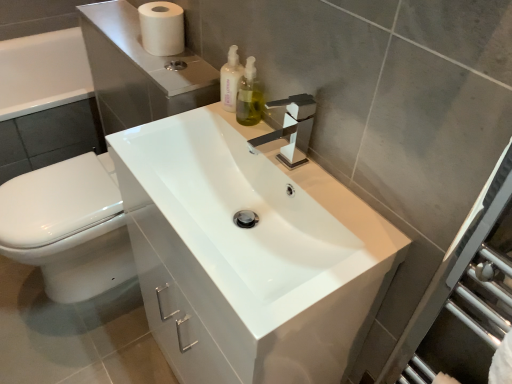
Find the location of a particular element. Image resolution: width=512 pixels, height=384 pixels. green glass soap dispenser at upper center, arranged as the 2th soap dispenser when viewed from the left is located at coordinates (249, 97).

In the scene shown: Measure the distance between point (249, 100) and camera.

A distance of 1.05 meters exists between point (249, 100) and camera.

This screenshot has width=512, height=384. Describe the element at coordinates (67, 227) in the screenshot. I see `white glossy toilet at lower left` at that location.

Identify the location of white glossy sink at center. This screenshot has width=512, height=384. (252, 210).

Identify the location of green glass soap dispenser at upper center, the first soap dispenser from the right. This screenshot has height=384, width=512. (249, 97).

From the picture: Is white glossy sink at center not close to white matte toilet paper at upper left?

No.

Considering the sizes of objects white glossy sink at center and white matte toilet paper at upper left in the image provided, who is bigger, white glossy sink at center or white matte toilet paper at upper left?

white glossy sink at center.

From the image's perspective, is white glossy sink at center positioned above or below white matte toilet paper at upper left?

white glossy sink at center is situated lower than white matte toilet paper at upper left in the image.

Is white glossy toilet at lower left to the left or to the right of translucent plastic soap dispenser at upper center, which appears as the 2th soap dispenser when viewed from the right, in the image?

In the image, white glossy toilet at lower left appears on the left side of translucent plastic soap dispenser at upper center, which appears as the 2th soap dispenser when viewed from the right.

Is white glossy toilet at lower left positioned before translucent plastic soap dispenser at upper center, which appears as the 2th soap dispenser when viewed from the right?

No, the depth of white glossy toilet at lower left is greater than that of translucent plastic soap dispenser at upper center, which appears as the 2th soap dispenser when viewed from the right.

From a real-world perspective, is white glossy toilet at lower left located beneath translucent plastic soap dispenser at upper center, which appears as the 2th soap dispenser when viewed from the right?

Yes, from a real-world perspective, white glossy toilet at lower left is below translucent plastic soap dispenser at upper center, which appears as the 2th soap dispenser when viewed from the right.

From the image's perspective, would you say white glossy toilet at lower left is positioned over translucent plastic soap dispenser at upper center, which appears as the 2th soap dispenser when viewed from the right?

No.

Is the position of green glass soap dispenser at upper center, the first soap dispenser from the right, less distant than that of white matte toilet paper at upper left?

Yes, the depth of green glass soap dispenser at upper center, the first soap dispenser from the right, is less than that of white matte toilet paper at upper left.

Does green glass soap dispenser at upper center, arranged as the 2th soap dispenser when viewed from the left, have a smaller size compared to white matte toilet paper at upper left?

Yes, green glass soap dispenser at upper center, arranged as the 2th soap dispenser when viewed from the left, is smaller than white matte toilet paper at upper left.

Is green glass soap dispenser at upper center, arranged as the 2th soap dispenser when viewed from the left, facing towards white matte toilet paper at upper left?

No, green glass soap dispenser at upper center, arranged as the 2th soap dispenser when viewed from the left, is not facing towards white matte toilet paper at upper left.

Is green glass soap dispenser at upper center, the first soap dispenser from the right, surrounding white matte toilet paper at upper left?

Actually, white matte toilet paper at upper left is outside green glass soap dispenser at upper center, the first soap dispenser from the right.

Find the location of a particular element. This screenshot has width=512, height=384. the 2nd soap dispenser behind the white glossy sink at center, counting from the anchor's position is located at coordinates (230, 80).

Is translucent plastic soap dispenser at upper center, which appears as the 2th soap dispenser when viewed from the right, positioned beyond the bounds of white glossy sink at center?

Yes, translucent plastic soap dispenser at upper center, which appears as the 2th soap dispenser when viewed from the right, is not within white glossy sink at center.

Does translucent plastic soap dispenser at upper center, the 1th soap dispenser in the left-to-right sequence, lie in front of white glossy sink at center?

No, translucent plastic soap dispenser at upper center, the 1th soap dispenser in the left-to-right sequence, is further to the viewer.

Is point (224, 87) less distant than point (313, 246)?

That is False.

Are white matte toilet paper at upper left and white glossy sink at center making contact?

No, white matte toilet paper at upper left is not beside white glossy sink at center.

Does white matte toilet paper at upper left have a lesser height compared to white glossy sink at center?

Correct, white matte toilet paper at upper left is not as tall as white glossy sink at center.

Is white glossy sink at center at the back of white matte toilet paper at upper left?

No, white matte toilet paper at upper left's orientation is not away from white glossy sink at center.

From a real-world perspective, is white matte toilet paper at upper left located higher than white glossy sink at center?

Yes, from a real-world perspective, white matte toilet paper at upper left is above white glossy sink at center.

Does white glossy sink at center have a larger size compared to translucent plastic soap dispenser at upper center, the 1th soap dispenser in the left-to-right sequence?

Yes.

Between white glossy sink at center and translucent plastic soap dispenser at upper center, the 1th soap dispenser in the left-to-right sequence, which one is positioned in front?

Positioned in front is white glossy sink at center.

Is white glossy sink at center taller than translucent plastic soap dispenser at upper center, which appears as the 2th soap dispenser when viewed from the right?

Indeed, white glossy sink at center has a greater height compared to translucent plastic soap dispenser at upper center, which appears as the 2th soap dispenser when viewed from the right.

In the scene shown: Does white glossy sink at center appear on the right side of translucent plastic soap dispenser at upper center, which appears as the 2th soap dispenser when viewed from the right?

Indeed, white glossy sink at center is positioned on the right side of translucent plastic soap dispenser at upper center, which appears as the 2th soap dispenser when viewed from the right.

Looking at this image, is green glass soap dispenser at upper center, arranged as the 2th soap dispenser when viewed from the left, touching white glossy toilet at lower left?

They are not placed beside each other.

Based on their sizes in the image, would you say green glass soap dispenser at upper center, arranged as the 2th soap dispenser when viewed from the left, is bigger or smaller than white glossy toilet at lower left?

Considering their sizes, green glass soap dispenser at upper center, arranged as the 2th soap dispenser when viewed from the left, takes up less space than white glossy toilet at lower left.

Measure the distance between green glass soap dispenser at upper center, the first soap dispenser from the right, and white glossy toilet at lower left.

The distance of green glass soap dispenser at upper center, the first soap dispenser from the right, from white glossy toilet at lower left is 29.89 inches.

Is green glass soap dispenser at upper center, the first soap dispenser from the right, taller or shorter than white glossy toilet at lower left?

green glass soap dispenser at upper center, the first soap dispenser from the right, is shorter than white glossy toilet at lower left.

This screenshot has height=384, width=512. There is a white glossy sink at center. In order to click on toilet paper above it (from a real-world perspective) in this screenshot , I will do `click(162, 28)`.

The image size is (512, 384). I want to click on the 1st soap dispenser in front of the white glossy toilet at lower left, counting from the anchor's position, so click(x=230, y=80).

Based on the photo, which object lies nearer to the anchor point white matte toilet paper at upper left, white glossy sink at center or green glass soap dispenser at upper center, the first soap dispenser from the right?

Based on the image, green glass soap dispenser at upper center, the first soap dispenser from the right, appears to be nearer to white matte toilet paper at upper left.

Based on their spatial positions, is green glass soap dispenser at upper center, the first soap dispenser from the right, or white glossy sink at center closer to white matte toilet paper at upper left?

green glass soap dispenser at upper center, the first soap dispenser from the right, lies closer to white matte toilet paper at upper left than the other object.

When comparing their distances from white glossy sink at center, does translucent plastic soap dispenser at upper center, which appears as the 2th soap dispenser when viewed from the right, or white glossy toilet at lower left seem further?

white glossy toilet at lower left lies further to white glossy sink at center than the other object.

Which object lies nearer to the anchor point white glossy sink at center, white glossy toilet at lower left or green glass soap dispenser at upper center, arranged as the 2th soap dispenser when viewed from the left?

green glass soap dispenser at upper center, arranged as the 2th soap dispenser when viewed from the left.

From the picture: From the image, which object appears to be farther from white matte toilet paper at upper left, white glossy toilet at lower left or green glass soap dispenser at upper center, arranged as the 2th soap dispenser when viewed from the left?

white glossy toilet at lower left is further to white matte toilet paper at upper left.

When comparing their distances from white matte toilet paper at upper left, does green glass soap dispenser at upper center, the first soap dispenser from the right, or white glossy toilet at lower left seem closer?

Among the two, green glass soap dispenser at upper center, the first soap dispenser from the right, is located nearer to white matte toilet paper at upper left.

From the image, which object appears to be farther from white glossy toilet at lower left, translucent plastic soap dispenser at upper center, which appears as the 2th soap dispenser when viewed from the right, or green glass soap dispenser at upper center, arranged as the 2th soap dispenser when viewed from the left?

Among the two, green glass soap dispenser at upper center, arranged as the 2th soap dispenser when viewed from the left, is located further to white glossy toilet at lower left.

From the image, which object appears to be farther from green glass soap dispenser at upper center, arranged as the 2th soap dispenser when viewed from the left, white glossy toilet at lower left or translucent plastic soap dispenser at upper center, the 1th soap dispenser in the left-to-right sequence?

Based on the image, white glossy toilet at lower left appears to be further to green glass soap dispenser at upper center, arranged as the 2th soap dispenser when viewed from the left.

Locate an element on the screen. This screenshot has width=512, height=384. soap dispenser between white glossy toilet at lower left and white glossy sink at center in the horizontal direction is located at coordinates (230, 80).

The image size is (512, 384). I want to click on sink situated between white glossy toilet at lower left and green glass soap dispenser at upper center, the first soap dispenser from the right, from left to right, so click(x=252, y=210).

In order to click on toilet paper between white glossy toilet at lower left and green glass soap dispenser at upper center, the first soap dispenser from the right, from left to right in this screenshot , I will do click(x=162, y=28).

You are a GUI agent. You are given a task and a screenshot of the screen. Output one action in this format:
    pyautogui.click(x=<x>, y=<y>)
    Task: Click on the soap dispenser between white glossy toilet at lower left and green glass soap dispenser at upper center, the first soap dispenser from the right
    This screenshot has width=512, height=384.
    Given the screenshot: What is the action you would take?
    pyautogui.click(x=230, y=80)